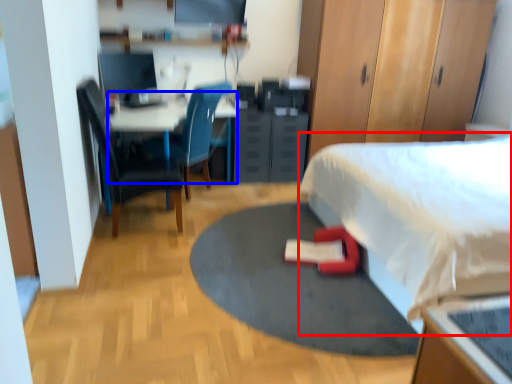
Question: Among these objects, which one is farthest to the camera, bed (highlighted by a red box) or desk (highlighted by a blue box)?

Choices:
 (A) bed
 (B) desk

Answer: (B)